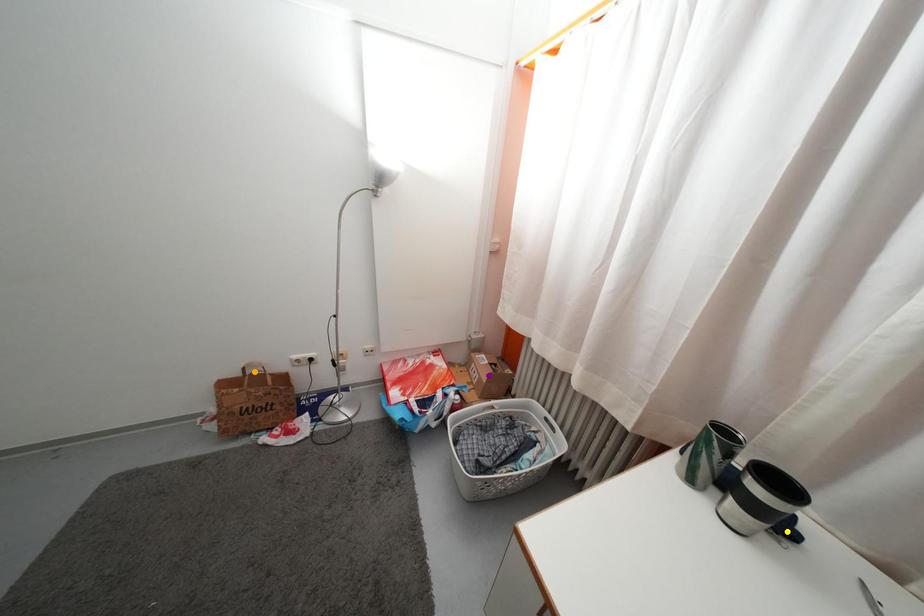
Order these from nearest to farthest:
- purple point
- yellow point
- orange point

yellow point, orange point, purple point